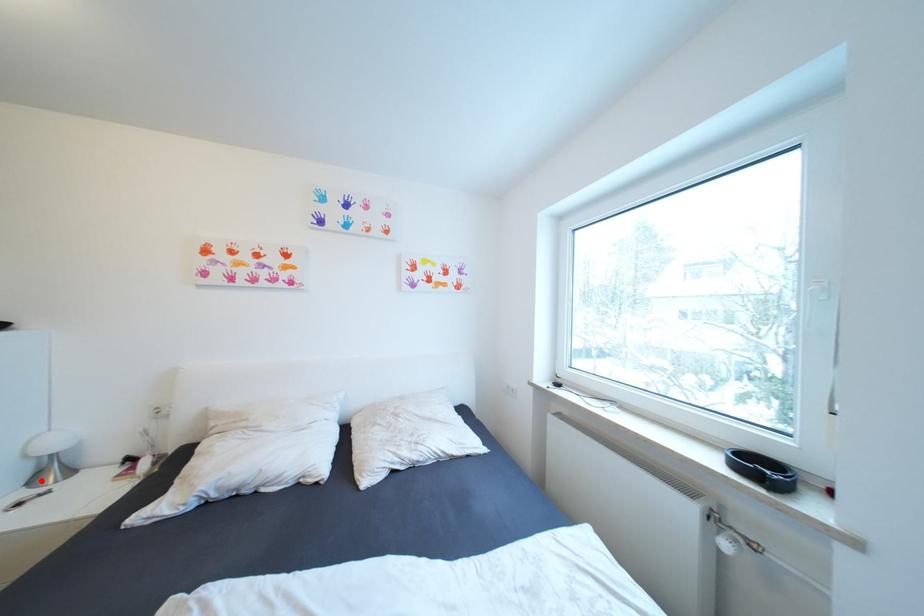
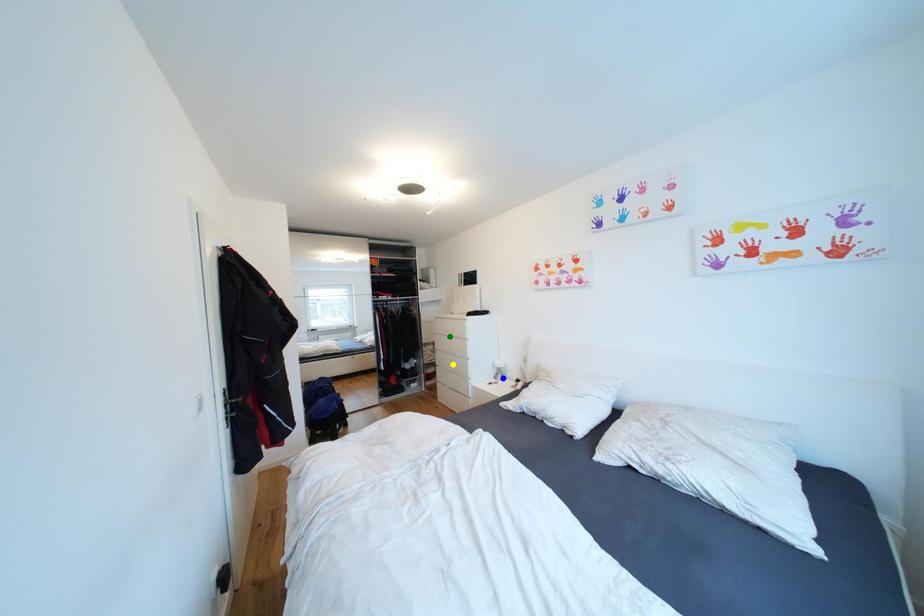
Question: I am providing you with two images of the same scene from different viewpoints. A red point is marked on the first image. You are given multiple points on the second image. Can you choose the point in image 2 that corresponds to the point in image 1?

Choices:
 (A) yellow point
 (B) blue point
 (C) green point

Answer: (B)